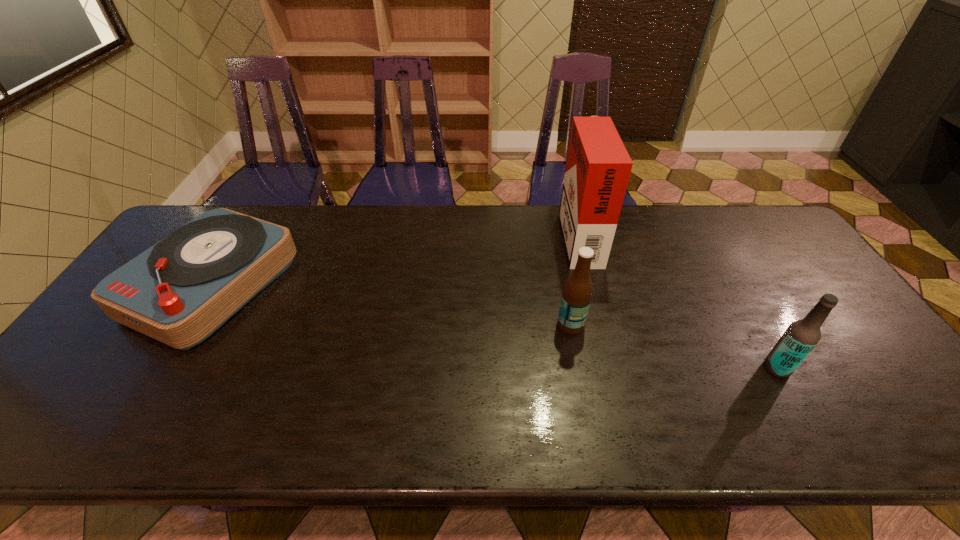
Locate an element on the screen. vacant space at the left edge of the desktop is located at coordinates (149, 348).

I want to click on free space at the right edge of the desktop, so coord(816,290).

Where is `vacant space at the near left corner of the desktop`? Image resolution: width=960 pixels, height=540 pixels. vacant space at the near left corner of the desktop is located at coordinates (38, 447).

The image size is (960, 540). I want to click on vacant area that lies between the leftmost object and the nearest object, so click(x=494, y=327).

Where is `free area in between the farther beer bottle and the shortest object`? This screenshot has width=960, height=540. free area in between the farther beer bottle and the shortest object is located at coordinates (392, 305).

Locate an element on the screen. The image size is (960, 540). blank region between the left beer bottle and the nearer beer bottle is located at coordinates (674, 346).

This screenshot has width=960, height=540. Find the location of `free space between the cigarette case and the nearer beer bottle`. free space between the cigarette case and the nearer beer bottle is located at coordinates (678, 301).

I want to click on vacant area that lies between the nearest object and the leftmost object, so click(494, 327).

Identify which object is the third closest to the cigarette case. Please provide its 2D coordinates. Your answer should be formatted as a tuple, i.e. [(x, y)], where the tuple contains the x and y coordinates of a point satisfying the conditions above.

[(181, 290)]

You are a GUI agent. You are given a task and a screenshot of the screen. Output one action in this format:
    pyautogui.click(x=<x>, y=<y>)
    Task: Click on the second closest object to the leftmost object
    The image size is (960, 540).
    Given the screenshot: What is the action you would take?
    pyautogui.click(x=598, y=166)